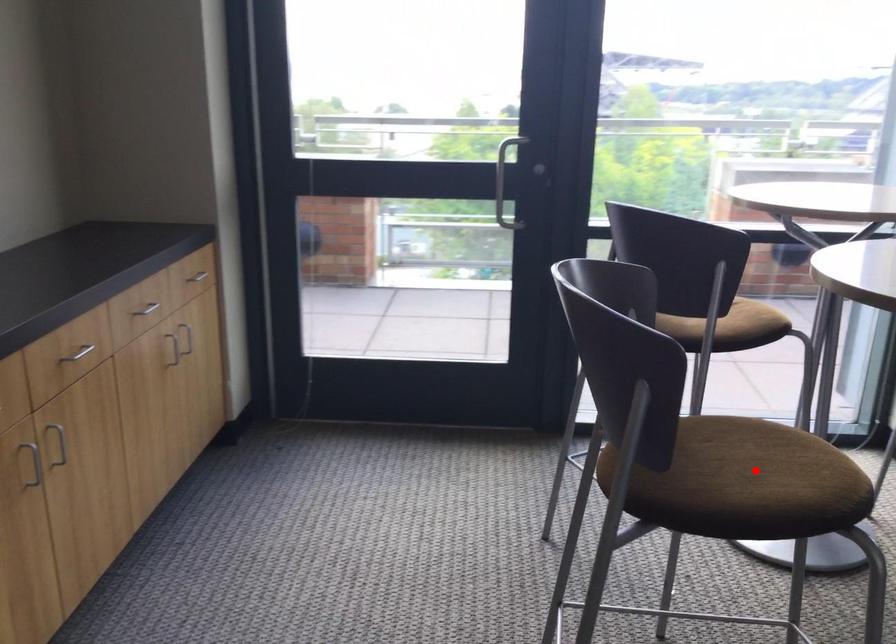
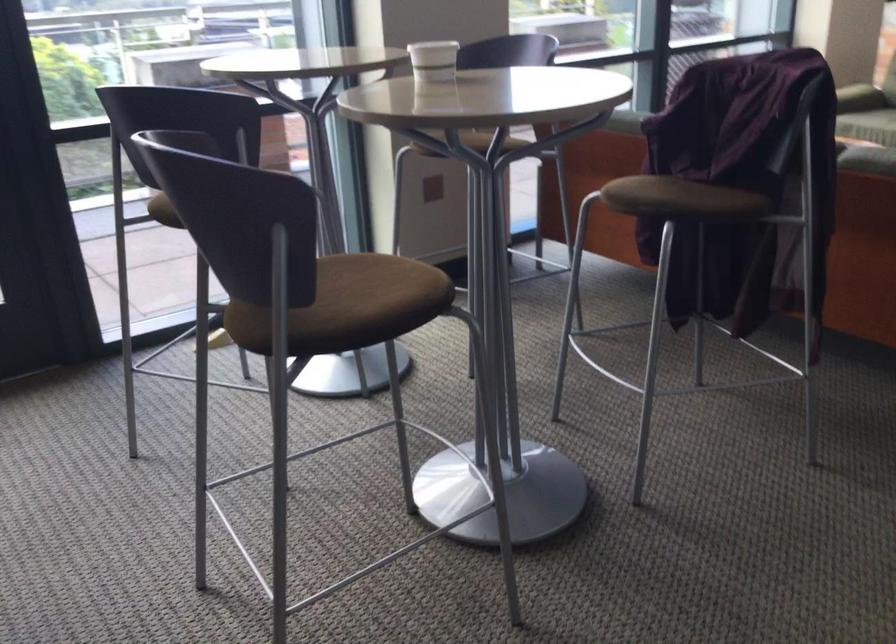
Question: I am providing you with two images of the same scene from different viewpoints. Given a red point in image1, look at the same physical point in image2. Is it:

Choices:
 (A) Closer to the viewpoint
 (B) Farther from the viewpoint

Answer: (B)